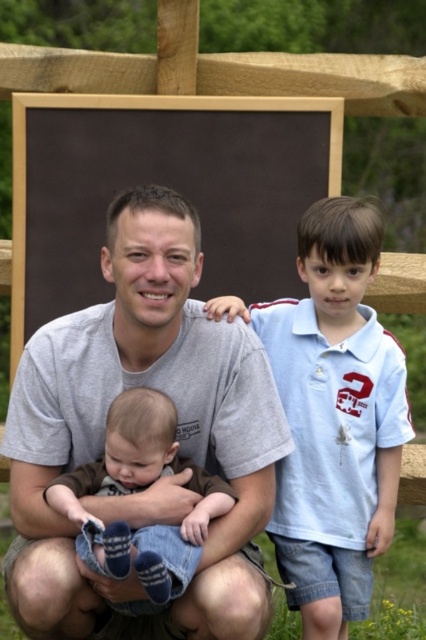
You are a photographer trying to capture the family moment. The light blue cotton shirt at right is positioned above the soft brown fabric baby at center. To ensure the baby is in focus while still including the shirt in the frame, where should you adjust your camera focus?

You should focus on the soft brown fabric baby at center since it is closer to the camera than the light blue cotton shirt at right, which is above it.

Based on the scene description, can you determine the spatial relationship between the light blue cotton shirt at right and the soft brown fabric baby at center?

The light blue cotton shirt at right is located to the right of the soft brown fabric baby at center.